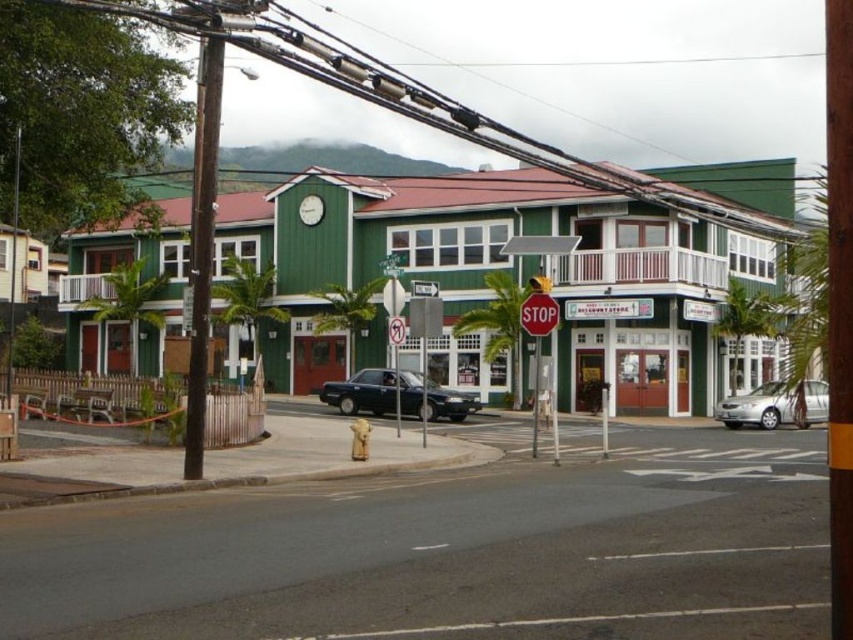
You are a pedestrian standing on the sidewalk in front of the vibrant green building. You see a white plastic stop sign at center and a green plastic sign at center. Which one is positioned to the right of the other?

The white plastic stop sign at center is positioned to the right of the green plastic sign at center.